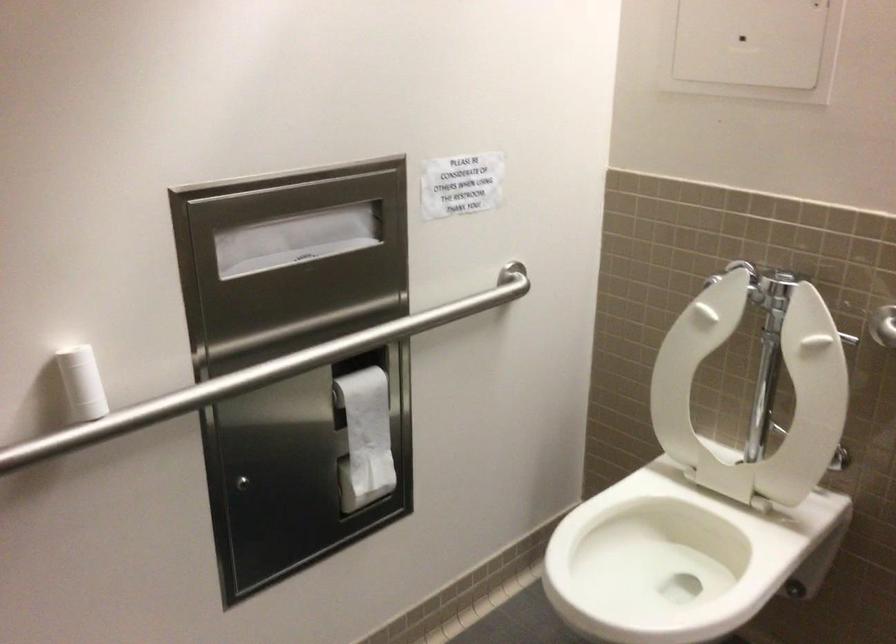
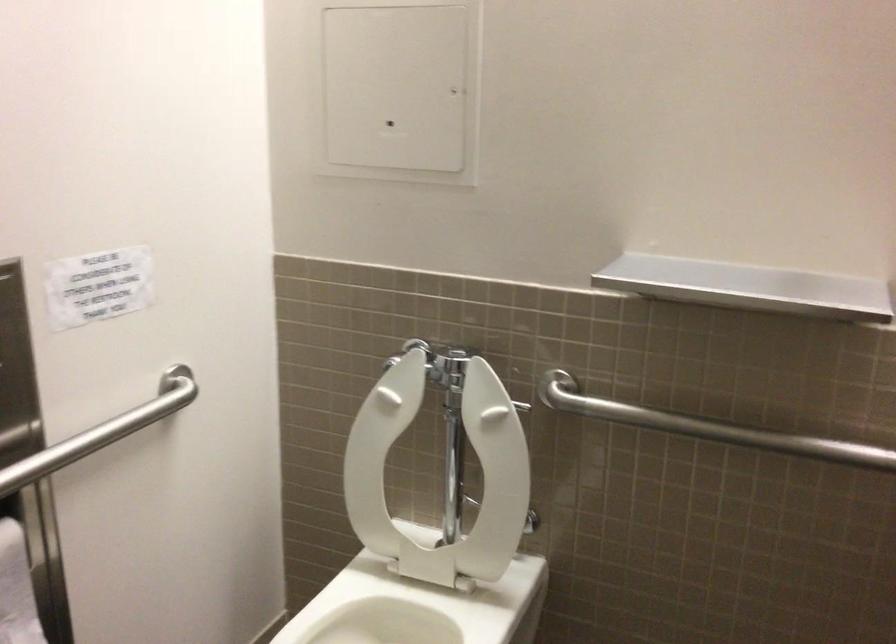
The point at (745, 395) is marked in the first image. Where is the corresponding point in the second image?

(440, 474)